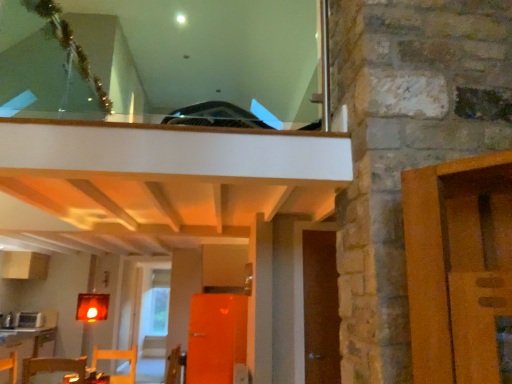
Question: From the image's perspective, is white glossy microwave at lower left below wooden table at lower left, arranged as the 1th table when viewed from the top?

Choices:
 (A) yes
 (B) no

Answer: (A)

Question: Is white glossy microwave at lower left smaller than wooden table at lower left, placed as the 1th table when sorted from front to back?

Choices:
 (A) yes
 (B) no

Answer: (B)

Question: Is white glossy microwave at lower left to the left of wooden table at lower left, the 1th table when ordered from right to left, from the viewer's perspective?

Choices:
 (A) yes
 (B) no

Answer: (A)

Question: From the image's perspective, is white glossy microwave at lower left over wooden table at lower left, which is counted as the second table, starting from the back?

Choices:
 (A) no
 (B) yes

Answer: (A)

Question: Can you confirm if white glossy microwave at lower left is taller than wooden table at lower left, which is counted as the second table, starting from the back?

Choices:
 (A) yes
 (B) no

Answer: (A)

Question: Can we say white glossy microwave at lower left lies outside wooden table at lower left, which is counted as the second table, starting from the back?

Choices:
 (A) no
 (B) yes

Answer: (B)

Question: From a real-world perspective, is wooden chair at lower left positioned under wooden table at lower left, the first table when ordered from bottom to top, based on gravity?

Choices:
 (A) no
 (B) yes

Answer: (A)

Question: Does wooden chair at lower left lie in front of wooden table at lower left, placed as the first table when sorted from back to front?

Choices:
 (A) no
 (B) yes

Answer: (B)

Question: Does wooden chair at lower left come behind wooden table at lower left, placed as the first table when sorted from back to front?

Choices:
 (A) no
 (B) yes

Answer: (A)

Question: From the image's perspective, is wooden chair at lower left below wooden table at lower left, the second table positioned from the top?

Choices:
 (A) no
 (B) yes

Answer: (A)

Question: Can you confirm if wooden chair at lower left is taller than wooden table at lower left, the 2th table when ordered from right to left?

Choices:
 (A) yes
 (B) no

Answer: (B)

Question: Considering the relative sizes of wooden chair at lower left and wooden table at lower left, which is the 1th table in left-to-right order, in the image provided, is wooden chair at lower left thinner than wooden table at lower left, which is the 1th table in left-to-right order,?

Choices:
 (A) yes
 (B) no

Answer: (A)

Question: Is wooden chair at lower left to the right of white glossy microwave at lower left from the viewer's perspective?

Choices:
 (A) no
 (B) yes

Answer: (B)